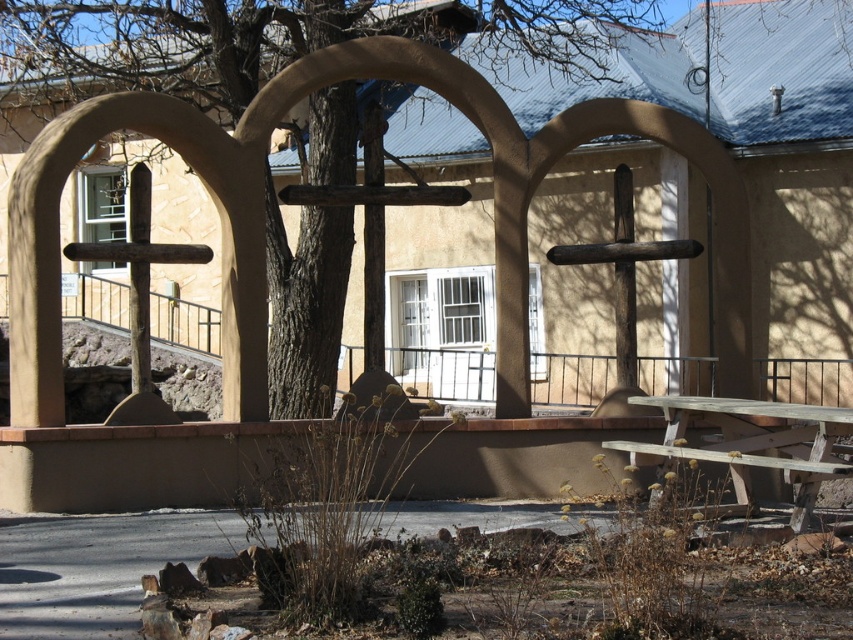
Question: Does brown rough tree at center come behind wooden picnic table at lower right?

Choices:
 (A) yes
 (B) no

Answer: (A)

Question: Which point appears closest to the camera in this image?

Choices:
 (A) (820, 432)
 (B) (573, 113)

Answer: (A)

Question: Is brown rough tree at center positioned at the back of wooden picnic table at lower right?

Choices:
 (A) no
 (B) yes

Answer: (B)

Question: Which point is farther to the camera?

Choices:
 (A) brown rough tree at center
 (B) wooden picnic table at lower right

Answer: (A)

Question: Does brown rough tree at center have a larger size compared to wooden picnic table at lower right?

Choices:
 (A) no
 (B) yes

Answer: (A)